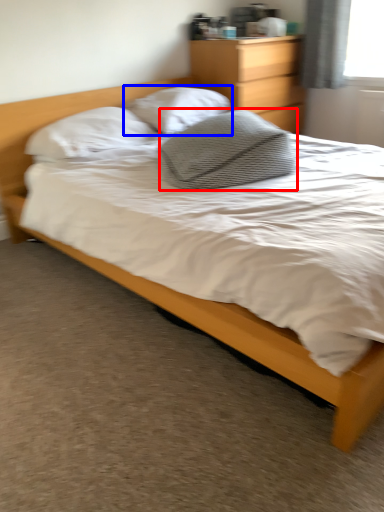
Question: Which object appears closest to the camera in this image, pillow (highlighted by a red box) or pillow (highlighted by a blue box)?

Choices:
 (A) pillow
 (B) pillow

Answer: (A)